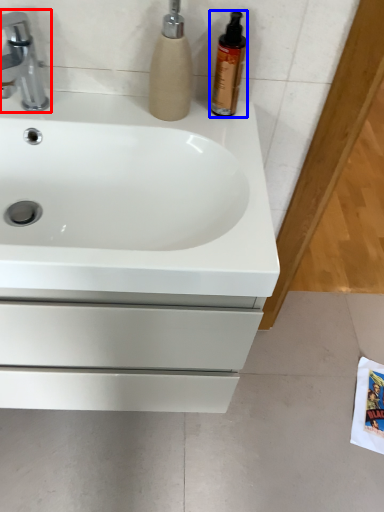
Question: Which point is further to the camera, tap (highlighted by a red box) or cleaning product (highlighted by a blue box)?

Choices:
 (A) tap
 (B) cleaning product

Answer: (B)